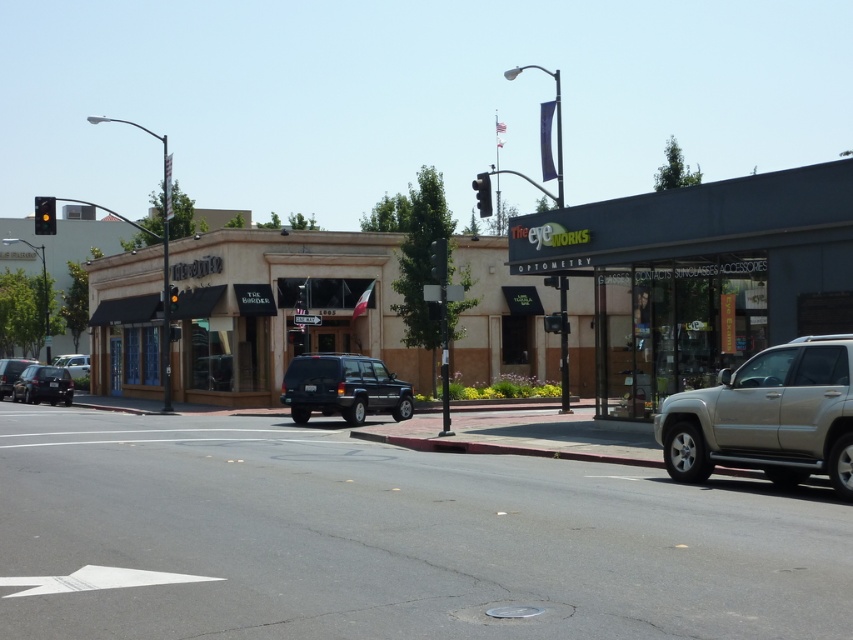
Question: Which object is closer to the camera taking this photo?

Choices:
 (A) beige stucco building at center
 (B) black asphalt road at center

Answer: (B)

Question: Can you confirm if black asphalt road at center is positioned to the left of metallic traffic light at center?

Choices:
 (A) yes
 (B) no

Answer: (A)

Question: Which point is farther to the camera?

Choices:
 (A) yellow glass traffic light at center
 (B) gold metallic suv at lower right

Answer: (A)

Question: Is matte black sign at center bigger than metallic silver car at left?

Choices:
 (A) yes
 (B) no

Answer: (A)

Question: Which object is closer to the camera taking this photo?

Choices:
 (A) matte black sign at center
 (B) beige stucco building at center
 (C) red glass traffic light at center

Answer: (A)

Question: Does gold metallic suv at lower right have a larger size compared to matte black car at lower left?

Choices:
 (A) yes
 (B) no

Answer: (B)